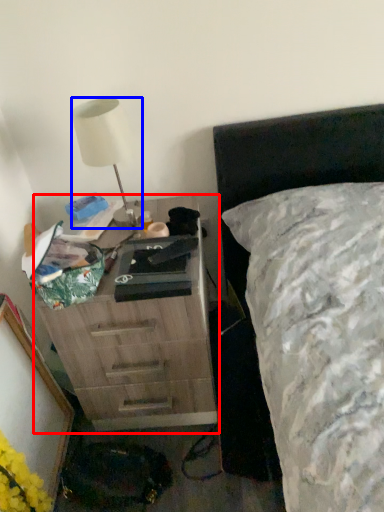
Question: Which object is closer to the camera taking this photo, chest of drawers (highlighted by a red box) or lamp (highlighted by a blue box)?

Choices:
 (A) chest of drawers
 (B) lamp

Answer: (A)